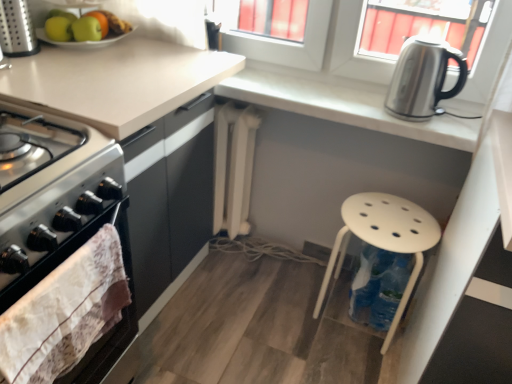
Locate an element on the screen. The image size is (512, 384). vacant point above white plastic stool at lower right (from a real-world perspective) is located at coordinates (381, 211).